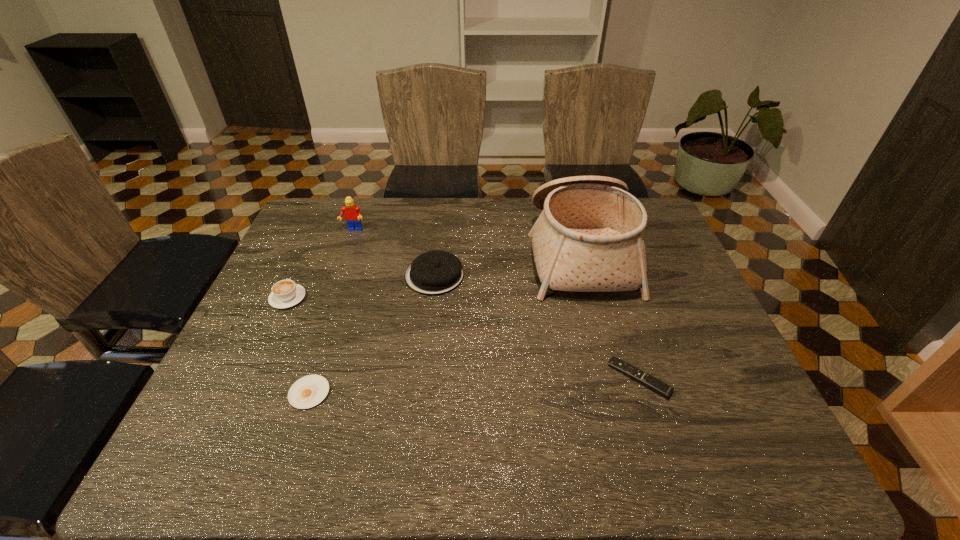
This screenshot has width=960, height=540. I want to click on Lego that is at the left edge, so (352, 212).

This screenshot has width=960, height=540. In order to click on cappuccino that is positioned at the left edge in this screenshot , I will do `click(285, 293)`.

The width and height of the screenshot is (960, 540). What are the coordinates of `object present at the right edge` in the screenshot? It's located at (589, 237).

Where is `object that is positioned at the far left corner`? The width and height of the screenshot is (960, 540). object that is positioned at the far left corner is located at coordinates (352, 212).

I want to click on object positioned at the far right corner, so click(x=589, y=237).

Locate an element on the screen. This screenshot has height=540, width=960. free space at the far edge of the desktop is located at coordinates (461, 204).

In the image, there is a desktop. Where is `vacant space at the near edge`? vacant space at the near edge is located at coordinates [x=673, y=461].

The width and height of the screenshot is (960, 540). I want to click on vacant space at the left edge of the desktop, so click(x=277, y=340).

I want to click on free space at the right edge of the desktop, so click(675, 251).

Where is `free location at the far left corner`? This screenshot has height=540, width=960. free location at the far left corner is located at coordinates (341, 212).